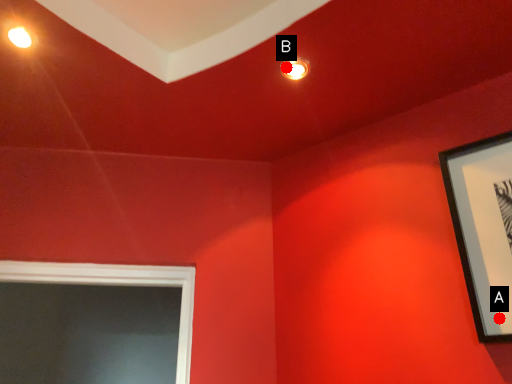
Question: Two points are circled on the image, labeled by A and B beside each circle. Which point is farther from the camera taking this photo?

Choices:
 (A) A is further
 (B) B is further

Answer: (B)